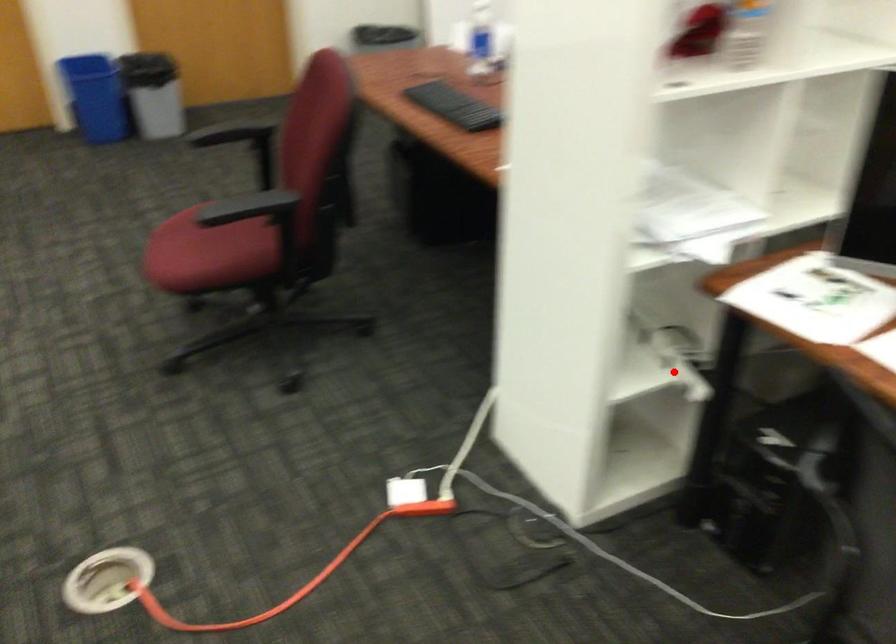
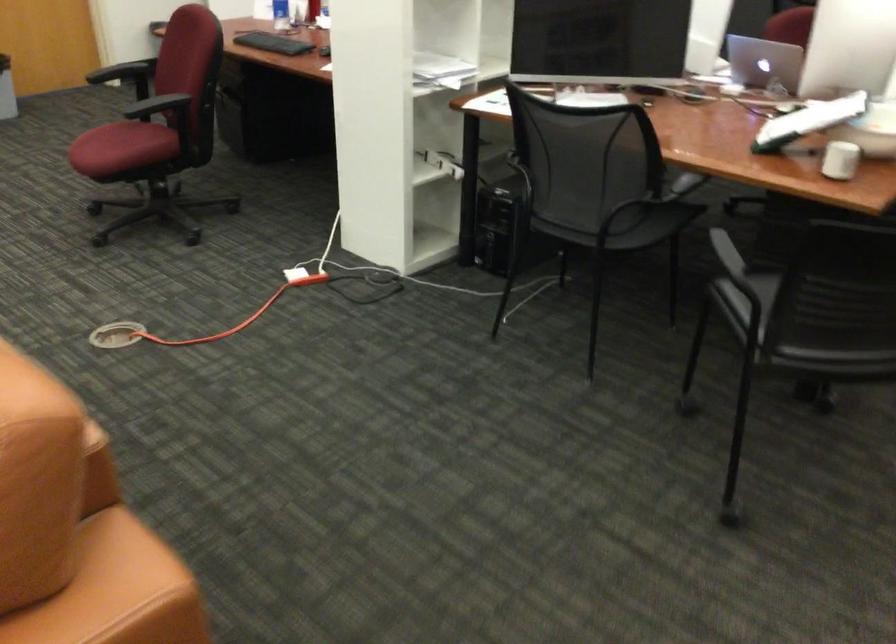
Find the pixel in the second image that matches the highlighted location in the first image.

(444, 163)